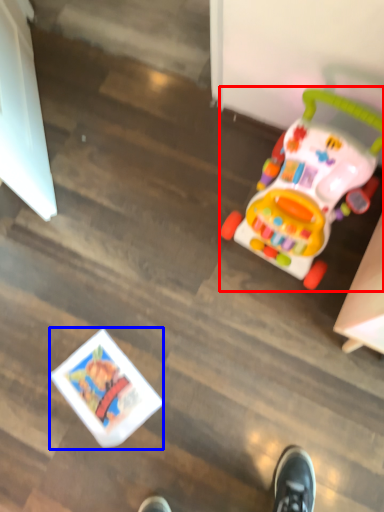
Question: Which object is closer to the camera taking this photo, toy (highlighted by a red box) or toy (highlighted by a blue box)?

Choices:
 (A) toy
 (B) toy

Answer: (A)